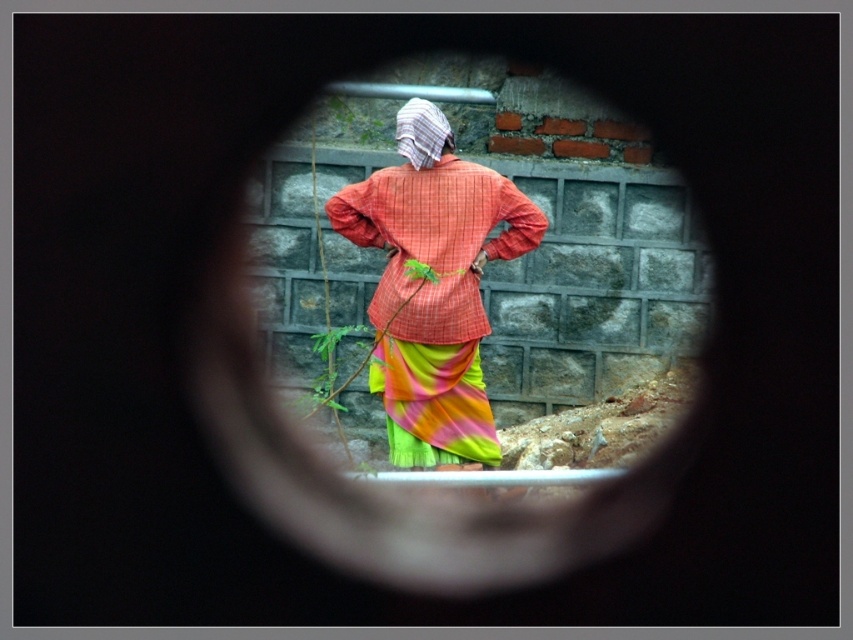
You are an architect inspecting a construction site. You notice the matte glass hole at center and the textured orange shirt at center. Which object is positioned higher in the scene?

The matte glass hole at center is above the textured orange shirt at center, so it is positioned higher.

You are a painter who needs to hang a 1.2 meter tall painting on the wall. You see the matte glass hole at center and the textured orange shirt at center. Which object is taller and can accommodate the painting?

The matte glass hole at center is taller than the textured orange shirt at center, so the painting can be hung there as it meets the height requirement.

You are a drone operator trying to navigate a small drone through a narrow space between two points in the image. The points are labeled as point 1 at coordinate point (643, 200) and point 2 at coordinate point (389, 168). Given that the drone has a wingspan of 0.1 units, can the drone safely pass through the space between these two points?

Point 1 at coordinate point (643, 200) is further to the viewer than point 2 at coordinate point (389, 168). The distance between them is not specified, but since the drone has a wingspan of 0.1 units, it can safely pass through the space between the two points if the distance between them is at least 0.1 units. However, without exact distance information, we cannot confirm.